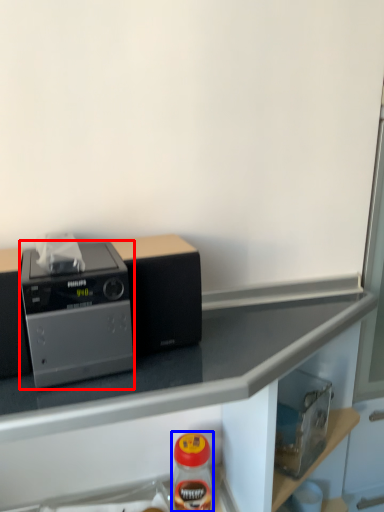
Question: Which of the following is the closest to the observer, home appliance (highlighted by a red box) or bottle (highlighted by a blue box)?

Choices:
 (A) home appliance
 (B) bottle

Answer: (A)